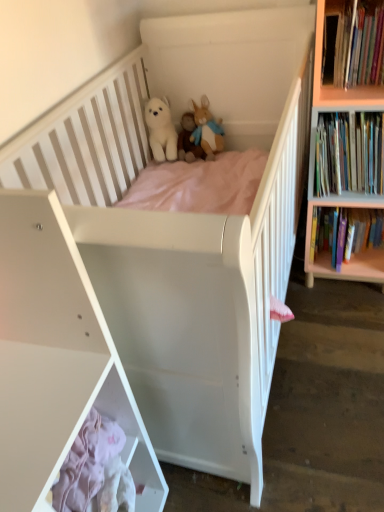
Question: Considering their positions, is fluffy beige rabbit at upper center, which is the 3th toy in left-to-right order, located in front of or behind hardcover books at right, which ranks as the 3th book in top-to-bottom order?

Choices:
 (A) front
 (B) behind

Answer: (B)

Question: From a real-world perspective, is fluffy beige rabbit at upper center, which is the 3th toy in left-to-right order, positioned above or below hardcover books at right, arranged as the first book when ordered from the bottom?

Choices:
 (A) above
 (B) below

Answer: (A)

Question: Which is nearer to the white plush bear at upper center, which is counted as the 2th toy, starting from the right?

Choices:
 (A) white plush bear at center, which is the 3th toy from right to left
 (B) fluffy beige rabbit at upper center, which is the 3th toy in left-to-right order
 (C) hardcover books at right, acting as the second book starting from the bottom
 (D) white matte cabinet at lower left
 (E) hardcover books at upper right, arranged as the 1th book when viewed from the top

Answer: (B)

Question: Estimate the real-world distances between objects in this image. Which object is closer to the hardcover books at right, acting as the second book starting from the bottom?

Choices:
 (A) light wood bookcase at right
 (B) hardcover books at upper right, the 3th book ordered from the bottom
 (C) white plush bear at center, which is counted as the first toy, starting from the left
 (D) white plush bear at upper center, which is counted as the 2th toy, starting from the right
 (E) white matte shelf at lower left

Answer: (A)